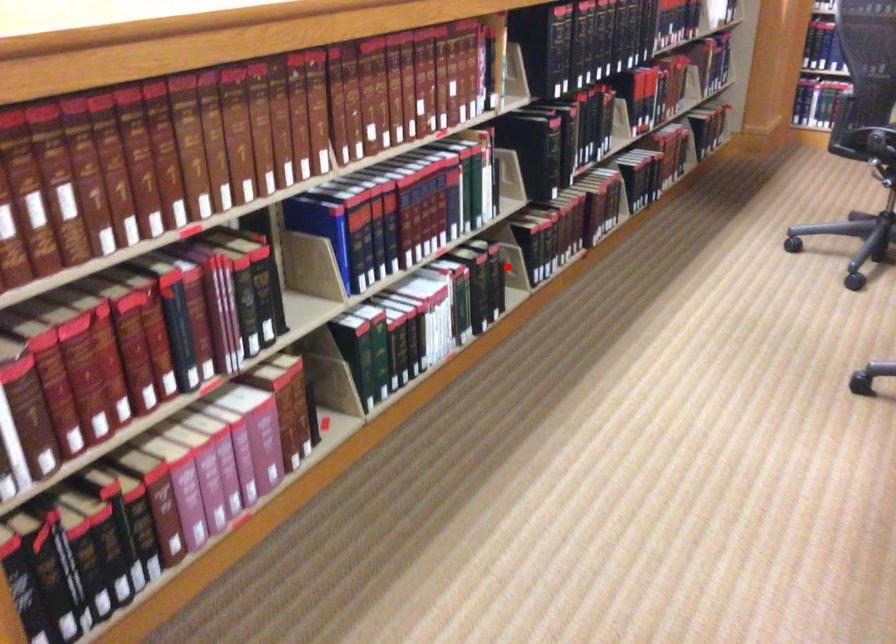
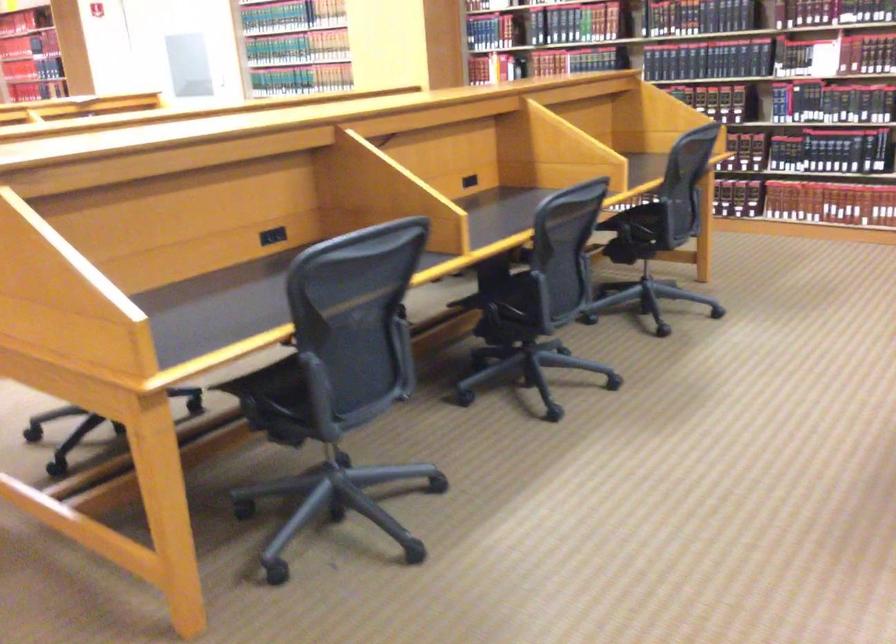
Question: I am providing you with two images of the same scene from different viewpoints. A red point is marked on the first image. Is the red point's position out of view in image 2?

Choices:
 (A) Yes
 (B) No

Answer: (A)